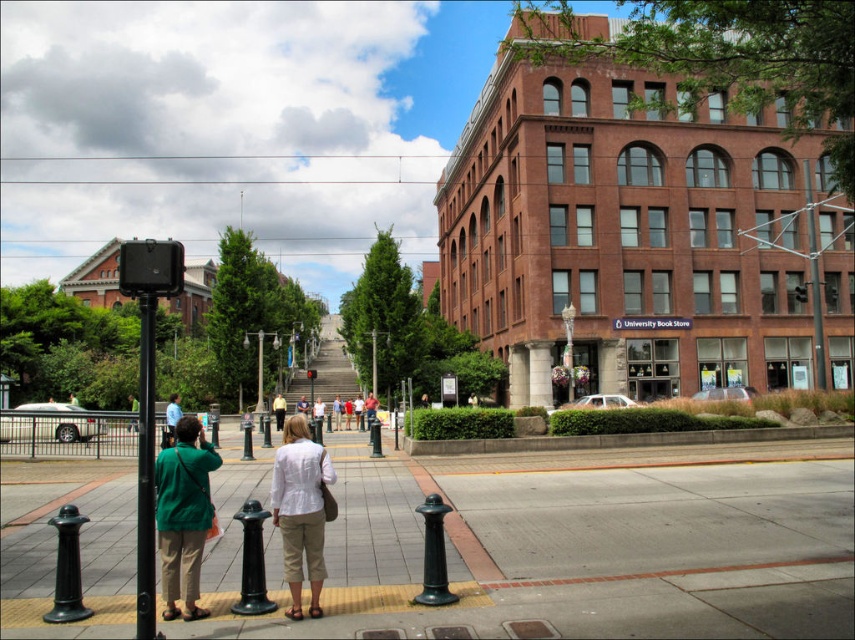
Between point (7, 621) and point (282, 465), which one is positioned behind?

The point (282, 465) is behind.

Does smooth concrete sidewalk at center have a greater height compared to white cotton shirt at center?

In fact, smooth concrete sidewalk at center may be shorter than white cotton shirt at center.

The image size is (855, 640). What are the coordinates of `smooth concrete sidewalk at center` in the screenshot? It's located at (563, 541).

Describe the element at coordinates (563, 541) in the screenshot. I see `smooth concrete sidewalk at center` at that location.

Can you confirm if smooth concrete sidewalk at center is taller than green matte jacket at lower left?

Yes.

The width and height of the screenshot is (855, 640). In order to click on smooth concrete sidewalk at center in this screenshot , I will do `click(563, 541)`.

Consider the image. Can you confirm if green matte jacket at lower left is positioned below black metal pole at left?

Incorrect, green matte jacket at lower left is not positioned below black metal pole at left.

Can you confirm if green matte jacket at lower left is positioned to the right of black metal pole at left?

Yes, green matte jacket at lower left is to the right of black metal pole at left.

You are a GUI agent. You are given a task and a screenshot of the screen. Output one action in this format:
    pyautogui.click(x=<x>, y=<y>)
    Task: Click on the green matte jacket at lower left
    This screenshot has height=640, width=855.
    Given the screenshot: What is the action you would take?
    pyautogui.click(x=183, y=515)